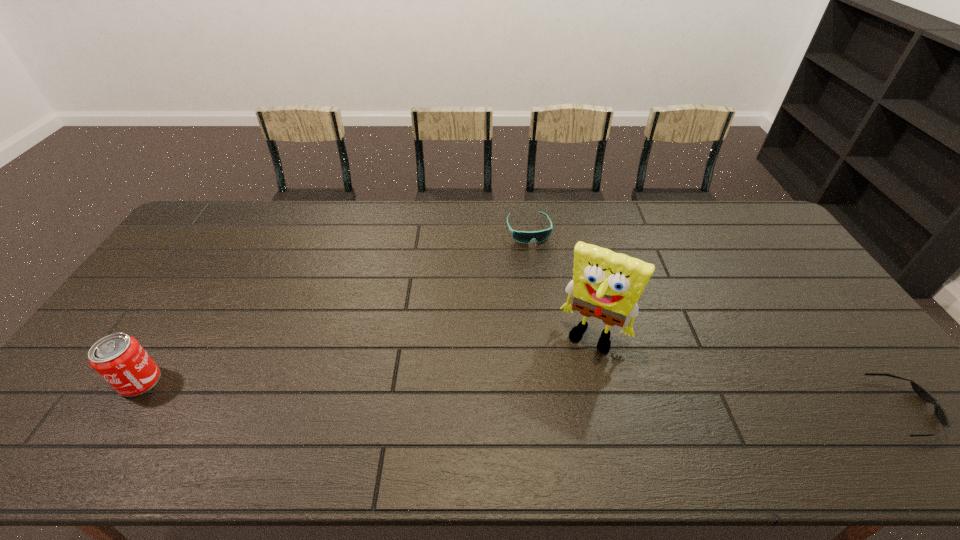
Find the location of a particular element. The width and height of the screenshot is (960, 540). the second tallest object is located at coordinates (119, 359).

This screenshot has height=540, width=960. What are the coordinates of `the leftmost object` in the screenshot? It's located at (119, 359).

Locate an element on the screen. the nearer sunglasses is located at coordinates [939, 412].

Find the location of `the shortest object`. the shortest object is located at coordinates (939, 412).

At what (x,y) coordinates should I click in order to perform the action: click on the farther sunglasses. Please return your answer as a coordinate pair (x, y). Looking at the image, I should click on click(x=525, y=237).

I want to click on the left sunglasses, so click(525, 237).

Image resolution: width=960 pixels, height=540 pixels. Identify the location of the second farthest object. (607, 285).

Where is `the tallest object`? Image resolution: width=960 pixels, height=540 pixels. the tallest object is located at coordinates (607, 285).

I want to click on free location located 0.220m on the right of the can, so click(x=247, y=381).

Where is `free region located 0.180m on the front-facing side of the farther sunglasses`? free region located 0.180m on the front-facing side of the farther sunglasses is located at coordinates (544, 282).